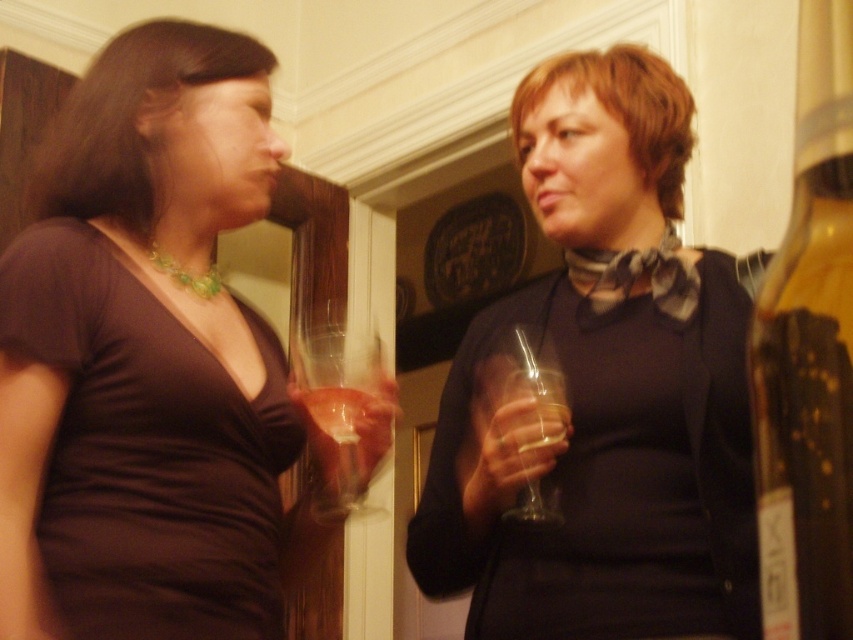
You are a photographer setting up a shoot in this scene. You need to position a spotlight so that it illuminates both the matte brown blouse at left and the transparent glass at center without casting shadows on the background wall. Given their height difference, where should you place the spotlight relative to them?

The matte brown blouse at left is much taller than the transparent glass at center, so placing the spotlight above and slightly behind the taller matte brown blouse at left would ensure both objects are illuminated while minimizing shadows on the background wall.

From the picture: You are a fashion designer observing the scene. You need to decide which item is more suitable for a close fit design. Based on their sizes, which item from the matte brown blouse at left and the transparent glass at center would you choose?

The transparent glass at center is smaller in size than the matte brown blouse at left, so it would be more suitable for a close fit design since smaller items typically allow for tailored, formfitting designs.